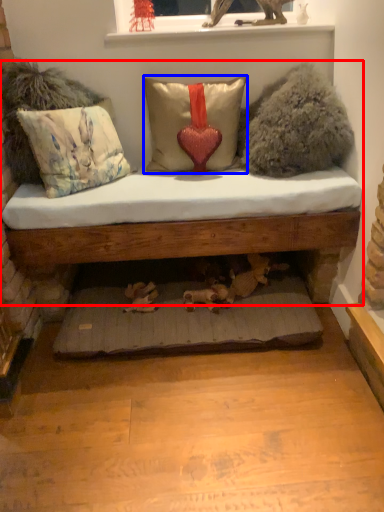
Question: Which object is further to the camera taking this photo, studio couch (highlighted by a red box) or pillow (highlighted by a blue box)?

Choices:
 (A) studio couch
 (B) pillow

Answer: (B)